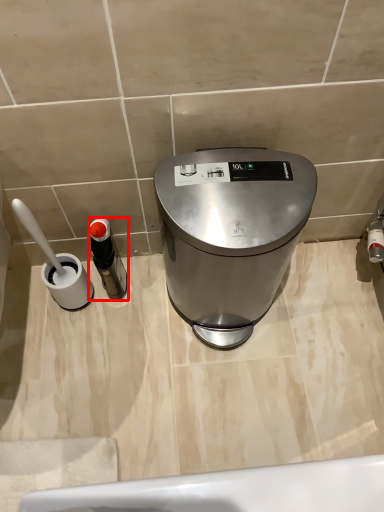
Question: From the image's perspective, where is bottle (annotated by the red box) located in relation to waste container in the image?

Choices:
 (A) above
 (B) below

Answer: (B)